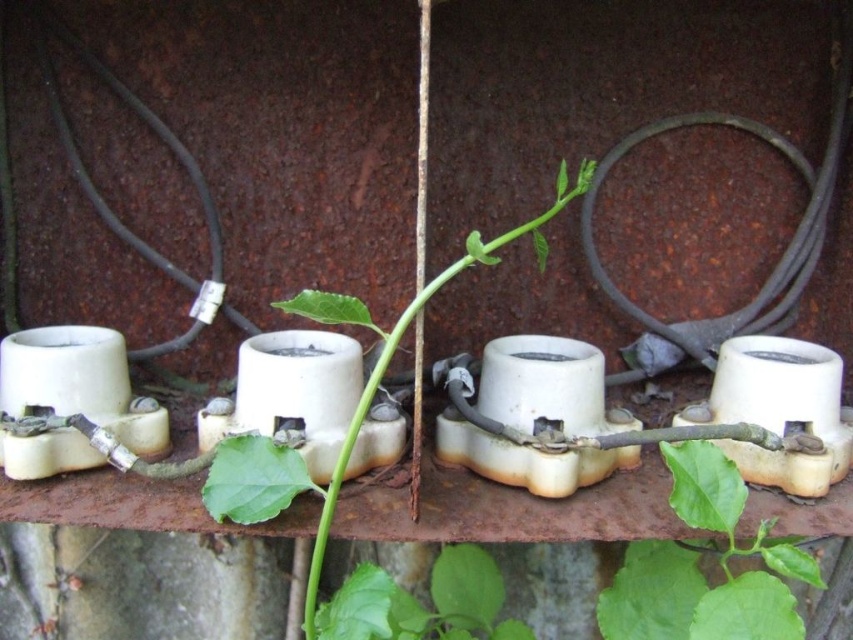
Is green matte leaf at center closer to the viewer compared to green leafy plant at center?

Yes.

Which is above, green matte leaf at center or green leafy plant at center?

green matte leaf at center

Measure the distance between green matte leaf at center and camera.

A distance of 22.89 inches exists between green matte leaf at center and camera.

Image resolution: width=853 pixels, height=640 pixels. I want to click on green matte leaf at center, so pyautogui.click(x=698, y=568).